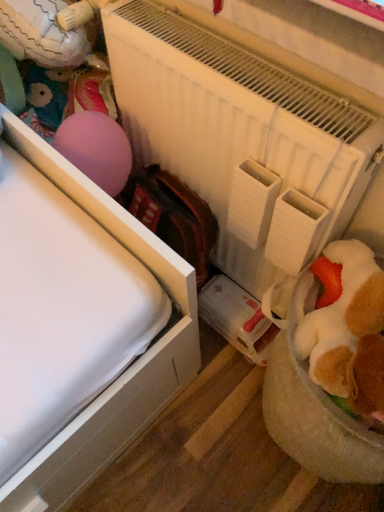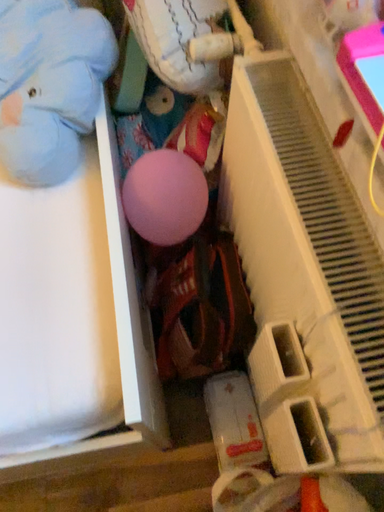
Question: Which way did the camera rotate in the video?

Choices:
 (A) rotated right
 (B) rotated left

Answer: (B)